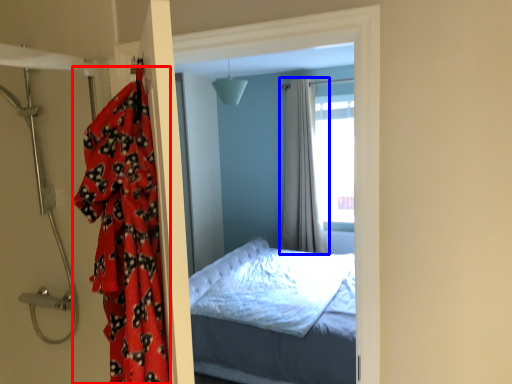
Question: Among these objects, which one is farthest to the camera, blanket (highlighted by a red box) or curtain (highlighted by a blue box)?

Choices:
 (A) blanket
 (B) curtain

Answer: (B)